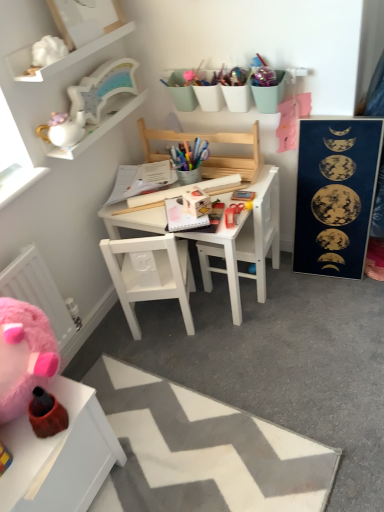
Find the location of a particular element. The width and height of the screenshot is (384, 512). free space to the right of white zigzag rug at lower center is located at coordinates (314, 374).